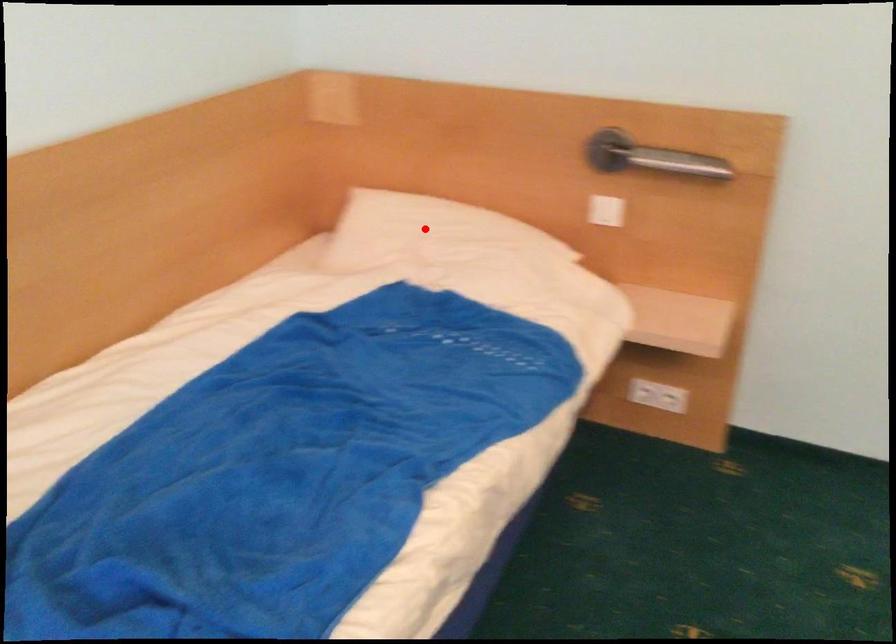
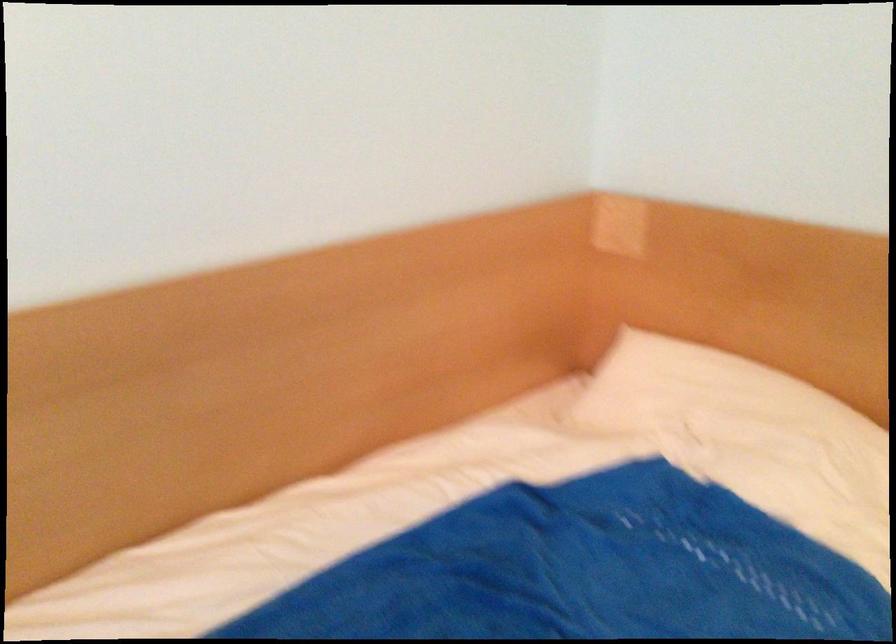
Question: I am providing you with two images of the same scene from different viewpoints. A red point is marked on the first image. Is the red point's position out of view in image 2?

Choices:
 (A) Yes
 (B) No

Answer: (B)